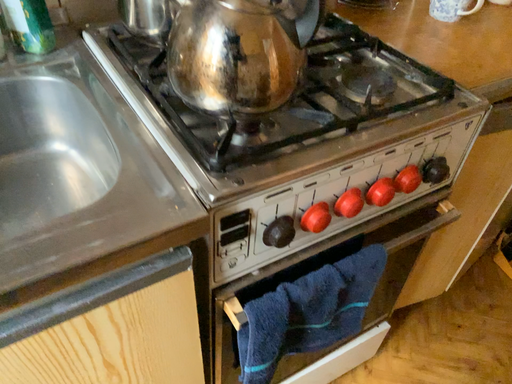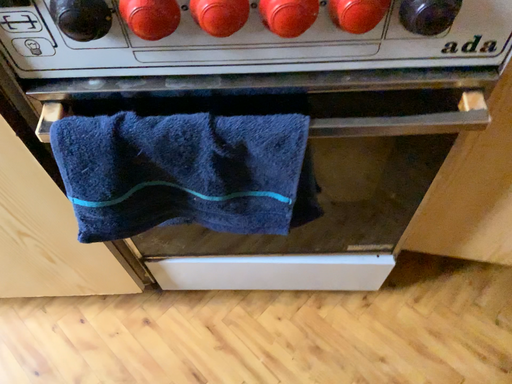
Question: How did the camera likely rotate when shooting the video?

Choices:
 (A) rotated upward
 (B) rotated downward

Answer: (B)